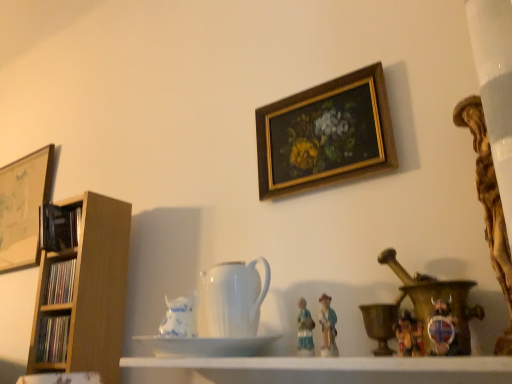
Question: Does matte wooden bookshelf at left, marked as the 1th book in a bottom-to-top arrangement, have a greater width compared to wooden picture frame at left, acting as the 2th picture frame starting from the right?

Choices:
 (A) yes
 (B) no

Answer: (A)

Question: Would you say matte wooden bookshelf at left, the third book in the top-to-bottom sequence, is outside wooden picture frame at left, placed as the second picture frame when sorted from front to back?

Choices:
 (A) yes
 (B) no

Answer: (A)

Question: Does matte wooden bookshelf at left, the third book in the top-to-bottom sequence, have a smaller size compared to wooden picture frame at left, the first picture frame in the back-to-front sequence?

Choices:
 (A) no
 (B) yes

Answer: (B)

Question: Is matte wooden bookshelf at left, the third book in the top-to-bottom sequence, positioned with its back to wooden picture frame at left, placed as the second picture frame when sorted from front to back?

Choices:
 (A) yes
 (B) no

Answer: (B)

Question: Is matte wooden bookshelf at left, the third book in the top-to-bottom sequence, at the left side of wooden picture frame at left, the first picture frame in the back-to-front sequence?

Choices:
 (A) yes
 (B) no

Answer: (B)

Question: Are matte wooden bookshelf at left, marked as the 1th book in a bottom-to-top arrangement, and wooden picture frame at left, the 1th picture frame in the left-to-right sequence, located far from each other?

Choices:
 (A) yes
 (B) no

Answer: (B)

Question: Is white porcelain pitcher at center bigger than white glossy shelf at center?

Choices:
 (A) no
 (B) yes

Answer: (A)

Question: Is white porcelain pitcher at center located outside white glossy shelf at center?

Choices:
 (A) no
 (B) yes

Answer: (B)

Question: Considering the relative sizes of white porcelain pitcher at center and white glossy shelf at center in the image provided, is white porcelain pitcher at center thinner than white glossy shelf at center?

Choices:
 (A) no
 (B) yes

Answer: (B)

Question: Is white porcelain pitcher at center at the right side of white glossy shelf at center?

Choices:
 (A) no
 (B) yes

Answer: (A)

Question: Is white porcelain pitcher at center next to white glossy shelf at center?

Choices:
 (A) yes
 (B) no

Answer: (B)

Question: Considering the relative sizes of white porcelain pitcher at center and white glossy shelf at center in the image provided, is white porcelain pitcher at center smaller than white glossy shelf at center?

Choices:
 (A) no
 (B) yes

Answer: (B)

Question: Is white glossy saucer at center smaller than wooden picture frame at left, the 1th picture frame in the left-to-right sequence?

Choices:
 (A) yes
 (B) no

Answer: (A)